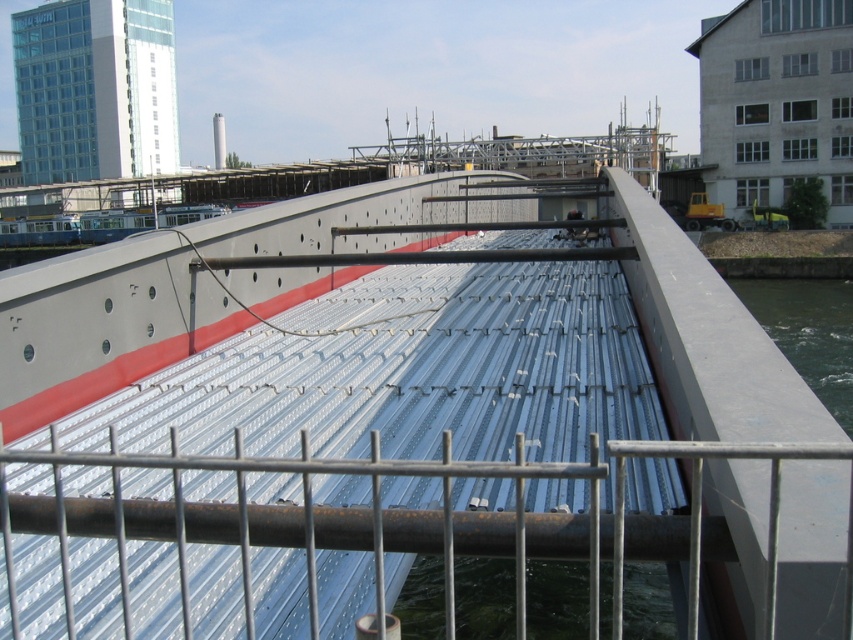
Question: Among these objects, which one is nearest to the camera?

Choices:
 (A) metallic silver boat at center
 (B) clear water at right

Answer: (A)

Question: Among these objects, which one is nearest to the camera?

Choices:
 (A) clear water at right
 (B) metallic silver boat at center

Answer: (B)

Question: Does silver metallic rail at center have a lesser width compared to clear water at right?

Choices:
 (A) yes
 (B) no

Answer: (A)

Question: Can you confirm if silver metallic rail at center is positioned to the right of clear water at right?

Choices:
 (A) no
 (B) yes

Answer: (A)

Question: Does silver metallic rail at center lie in front of clear water at right?

Choices:
 (A) yes
 (B) no

Answer: (A)

Question: Based on their relative distances, which object is nearer to the metallic silver boat at center?

Choices:
 (A) silver metallic rail at center
 (B) clear water at right

Answer: (A)